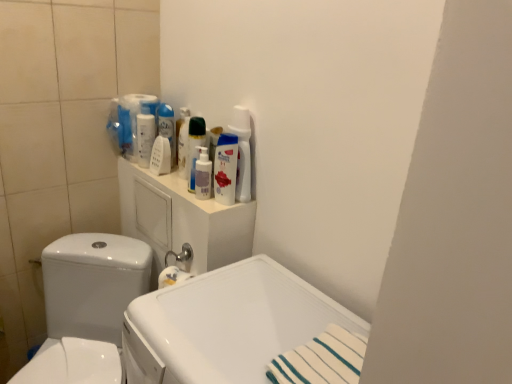
Where is `vacant space situated on the left part of semi-glossy white bottle at upper center, which is the 2th mouthwash in back-to-front order`? vacant space situated on the left part of semi-glossy white bottle at upper center, which is the 2th mouthwash in back-to-front order is located at coordinates (172, 188).